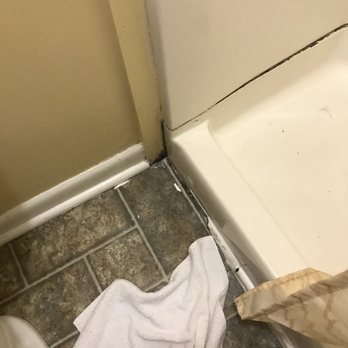
Find the location of `visible crack in shower`. visible crack in shower is located at coordinates (263, 73).